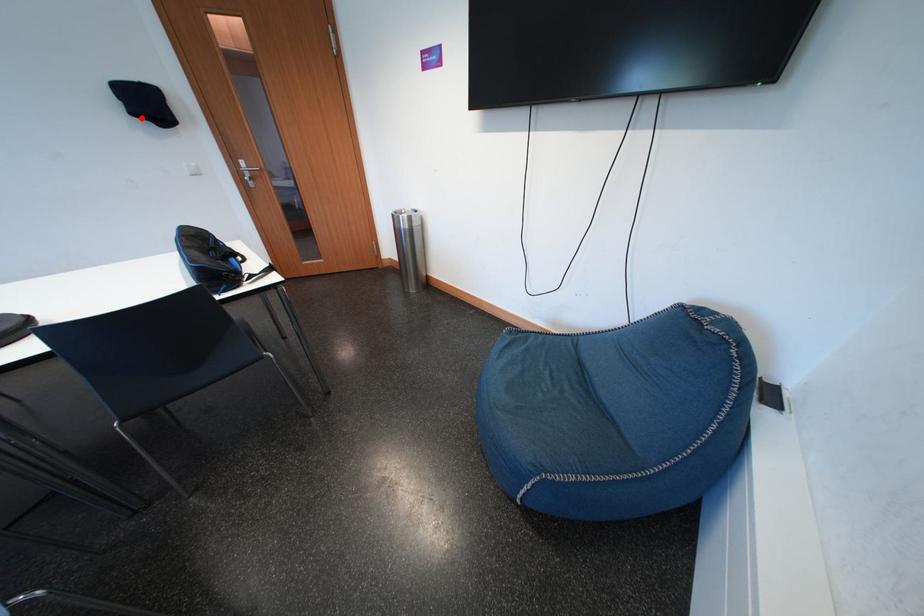
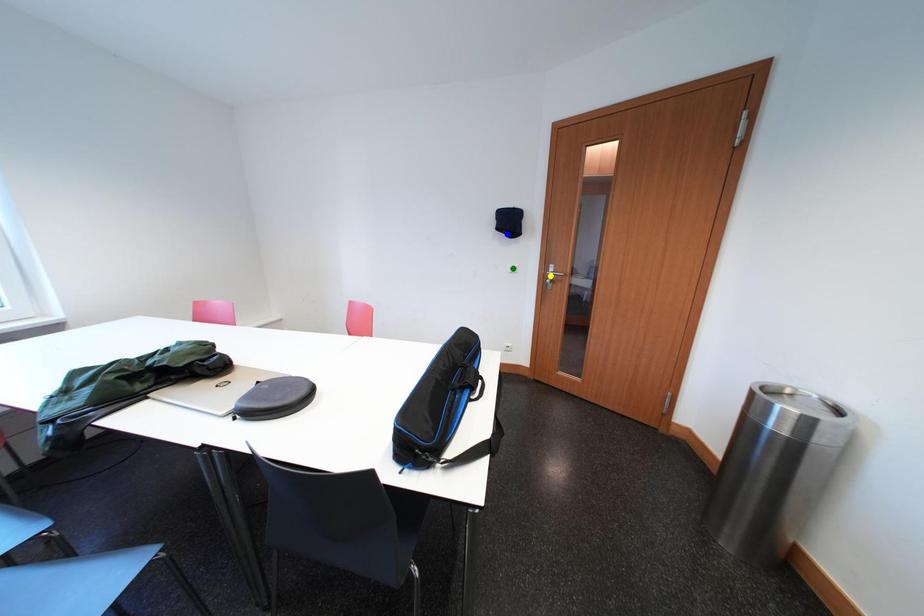
Question: I am providing you with two images of the same scene from different viewpoints. A red point is marked on the first image. You are given multiple points on the second image. In image 2, which mark is for the same physical point as the one in image 1?

Choices:
 (A) blue point
 (B) yellow point
 (C) green point

Answer: (A)